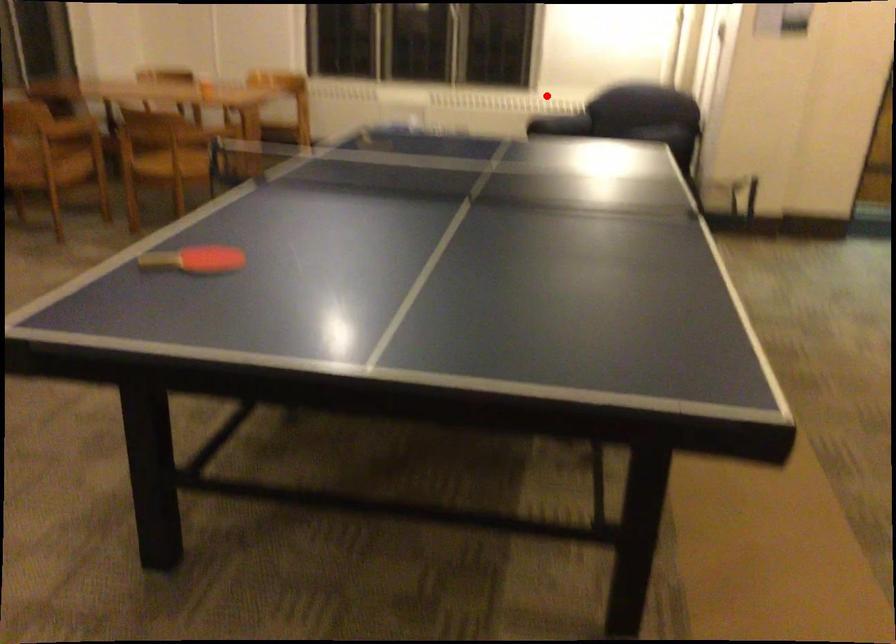
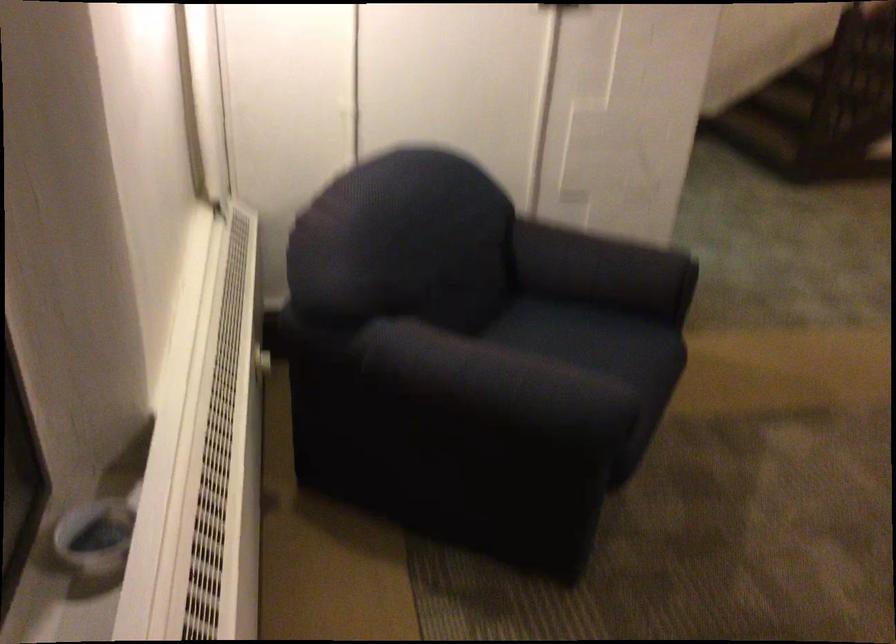
Locate, in the second image, the point that corresponds to the highlighted location in the first image.

(218, 462)